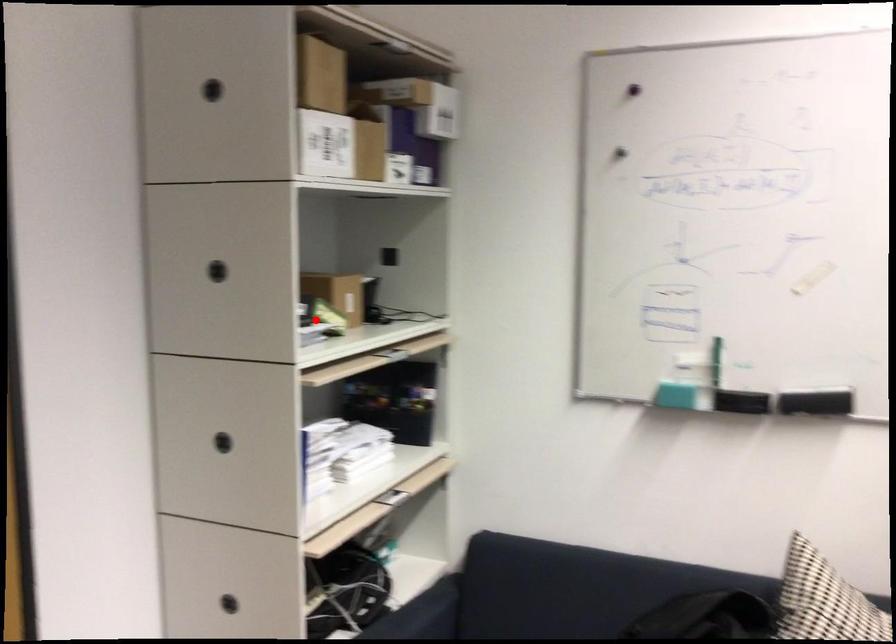
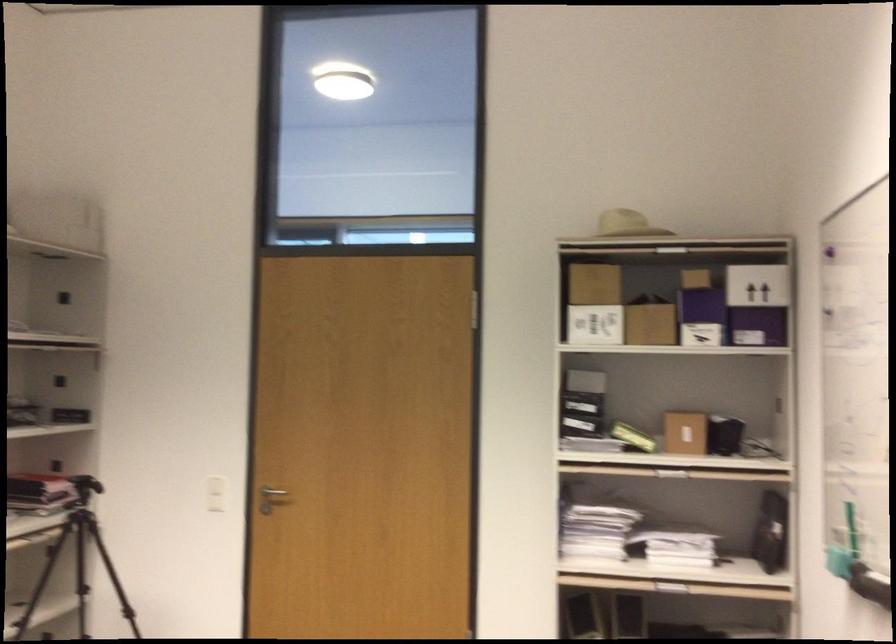
The point at the highlighted location is marked in the first image. Where is the corresponding point in the second image?

(633, 437)